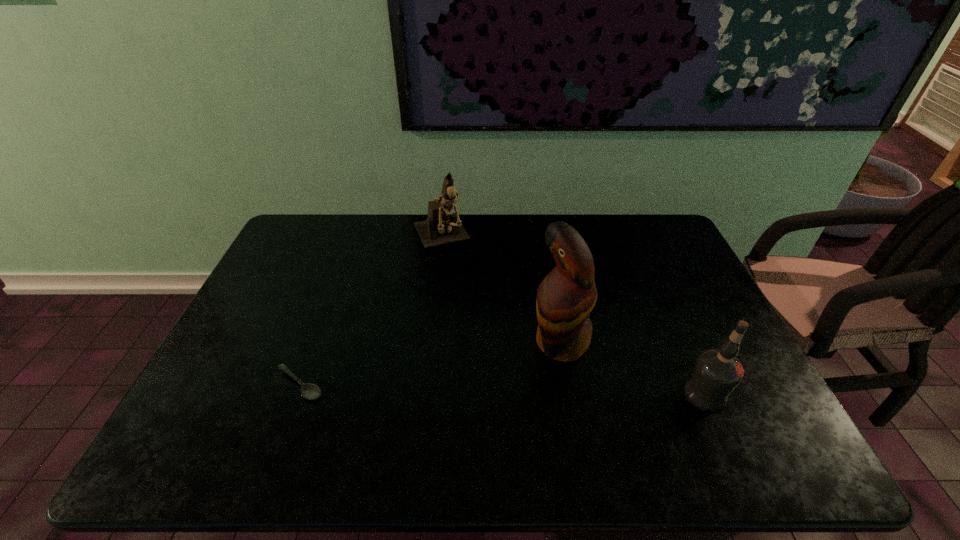
Where is `free space located 0.250m on the face of the second object from right to left`? The width and height of the screenshot is (960, 540). free space located 0.250m on the face of the second object from right to left is located at coordinates (454, 399).

In order to click on vacant space located on the face of the second object from right to left in this screenshot , I will do `click(454, 399)`.

At what (x,y) coordinates should I click in order to perform the action: click on vacant space located on the front-facing side of the figurine. Please return your answer as a coordinate pair (x, y). Looking at the image, I should click on (473, 310).

Find the location of a particular element. The image size is (960, 540). vacant space situated 0.110m on the front-facing side of the figurine is located at coordinates (459, 280).

This screenshot has width=960, height=540. Identify the location of free space located on the front-facing side of the figurine. (470, 303).

This screenshot has width=960, height=540. I want to click on object situated at the far edge, so click(442, 226).

Identify the location of soupspoon that is at the near edge. This screenshot has height=540, width=960. (309, 391).

Where is `vodka that is positioned at the near edge`? The height and width of the screenshot is (540, 960). vodka that is positioned at the near edge is located at coordinates (717, 372).

Image resolution: width=960 pixels, height=540 pixels. Find the location of `object that is at the right edge`. object that is at the right edge is located at coordinates (717, 372).

Locate an element on the screen. Image resolution: width=960 pixels, height=540 pixels. object present at the near right corner is located at coordinates (717, 372).